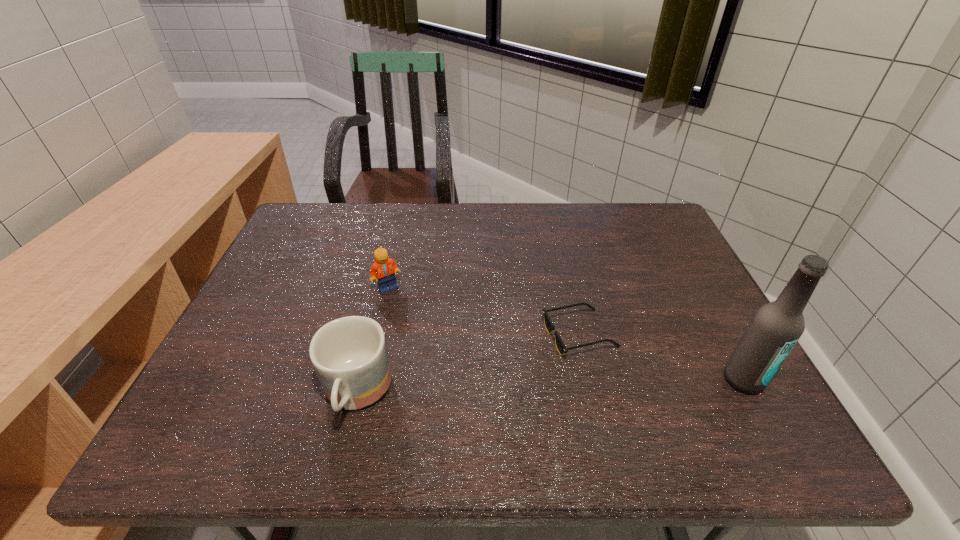
At what (x,y) coordinates should I click in order to perform the action: click on vacant space at the far right corner. Please return your answer as a coordinate pair (x, y). Image resolution: width=960 pixels, height=540 pixels. Looking at the image, I should click on (645, 210).

This screenshot has height=540, width=960. In order to click on unoccupied area between the rightmost object and the mug in this screenshot , I will do `click(550, 387)`.

You are a GUI agent. You are given a task and a screenshot of the screen. Output one action in this format:
    pyautogui.click(x=<x>, y=<y>)
    Task: Click on the empty space between the mug and the beer bottle
    
    Given the screenshot: What is the action you would take?
    pyautogui.click(x=550, y=387)

I want to click on vacant area that lies between the sunglasses and the mug, so click(x=468, y=365).

At what (x,y) coordinates should I click in order to perform the action: click on free space between the mug and the shortest object. Please return your answer as a coordinate pair (x, y). Looking at the image, I should click on (468, 365).

I want to click on vacant area that lies between the shortest object and the tallest object, so click(661, 357).

At what (x,y) coordinates should I click in order to perform the action: click on free space that is in between the farthest object and the beer bottle. Please return your answer as a coordinate pair (x, y). Looking at the image, I should click on (565, 334).

Locate an element on the screen. Image resolution: width=960 pixels, height=540 pixels. empty space between the mug and the tallest object is located at coordinates (550, 387).

Point out which object is positioned as the third nearest to the mug. Please provide its 2D coordinates. Your answer should be formatted as a tuple, i.e. [(x, y)], where the tuple contains the x and y coordinates of a point satisfying the conditions above.

[(775, 328)]

Where is `object that is the closest to the sunglasses`? This screenshot has height=540, width=960. object that is the closest to the sunglasses is located at coordinates (775, 328).